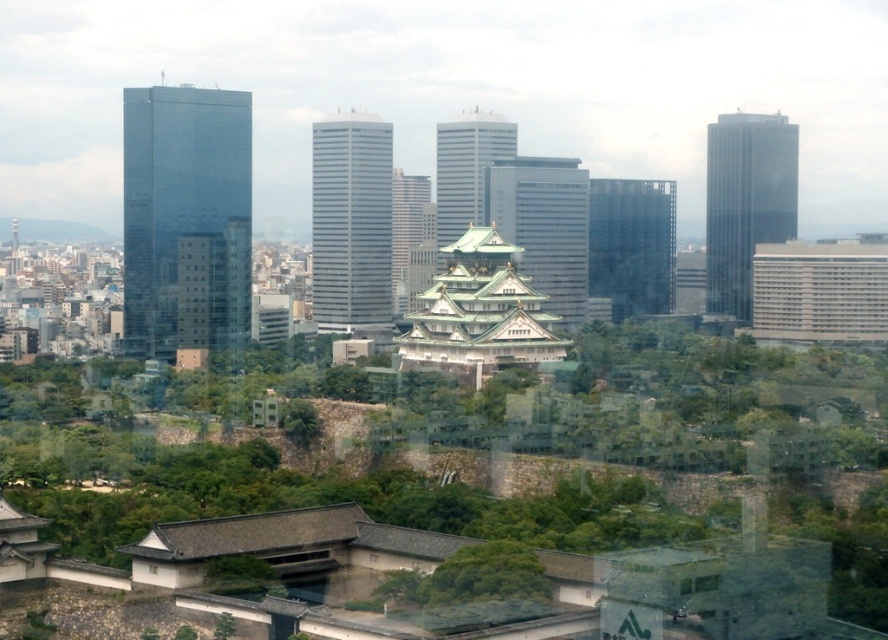
Question: Considering the real-world distances, which object is farthest from the shiny glass skyscraper at center?

Choices:
 (A) shiny glass skyscraper at left
 (B) smooth glass skyscraper at center
 (C) white glass tower at center
 (D) glassy reflective skyscraper at right

Answer: (D)

Question: Among these objects, which one is nearest to the camera?

Choices:
 (A) smooth glass skyscraper at center
 (B) white glass tower at center
 (C) shiny glass skyscraper at left
 (D) green leafy tree at center

Answer: (D)

Question: Can you confirm if shiny glass skyscraper at left is positioned to the right of dark glass skyscraper at center?

Choices:
 (A) no
 (B) yes

Answer: (A)

Question: Can you confirm if glassy reflective skyscraper at center is smaller than dark glass skyscraper at center?

Choices:
 (A) no
 (B) yes

Answer: (A)

Question: Observing the image, what is the correct spatial positioning of green leafy tree at center in reference to smooth glass skyscraper at center?

Choices:
 (A) right
 (B) left

Answer: (B)

Question: Which object appears farthest from the camera in this image?

Choices:
 (A) shiny glass skyscraper at center
 (B) glassy reflective skyscraper at right

Answer: (B)